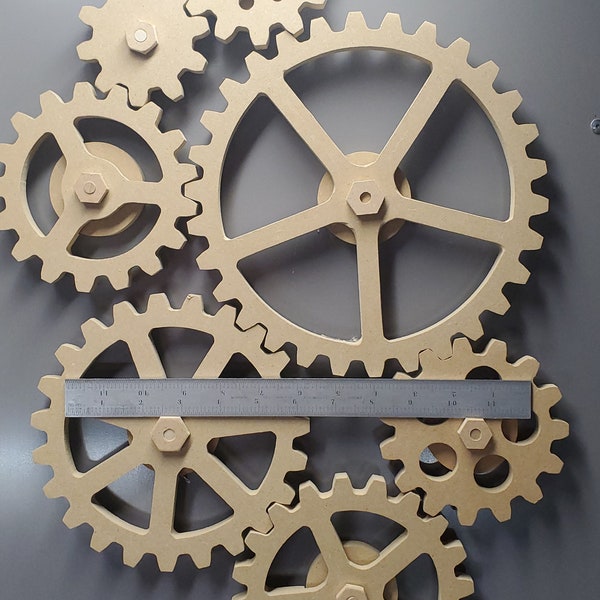
You are a GUI agent. You are given a task and a screenshot of the screen. Output one action in this format:
    pyautogui.click(x=<x>, y=<y>)
    Task: Click on the wall
    Image resolution: width=600 pixels, height=600 pixels.
    Given the screenshot: What is the action you would take?
    pyautogui.click(x=269, y=203)